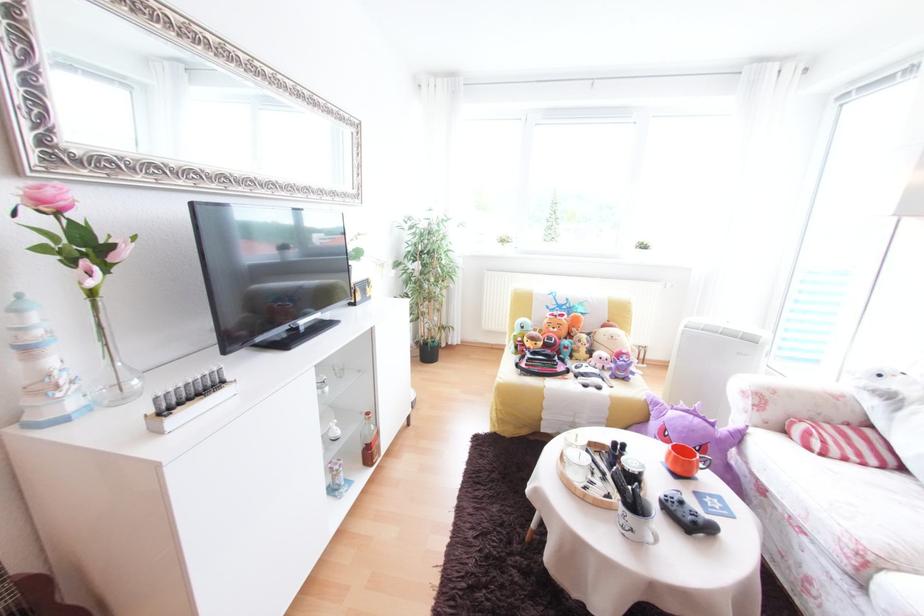
Where would you rest the floral sofa armrest? Please return your answer as a coordinate pair (x, y).

(809, 384)